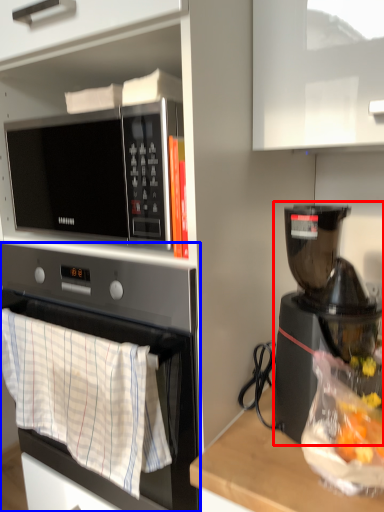
Question: Which point is further to the camera, coffee maker (highlighted by a red box) or oven (highlighted by a blue box)?

Choices:
 (A) coffee maker
 (B) oven

Answer: (B)